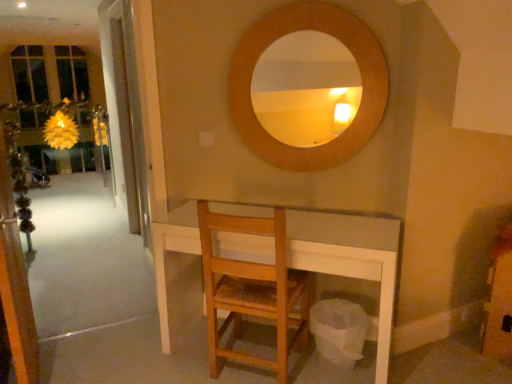
Measure the distance between point (11,227) and camera.

The depth of point (11,227) is 6.30 feet.

Describe the element at coordinates (331, 35) in the screenshot. Image resolution: width=512 pixels, height=384 pixels. I see `wooden circle at upper center` at that location.

The image size is (512, 384). I want to click on wooden circle at upper center, so click(x=331, y=35).

What do you see at coordinates (129, 115) in the screenshot? I see `clear glass door at left, which is counted as the 2th screen door, starting from the front` at bounding box center [129, 115].

Locate an element on the screen. transparent glass screen door at left, the second screen door from the back is located at coordinates (15, 282).

Could you tell me if transparent glass screen door at left, which is the first screen door from front to back, is turned towards wooden chair at center?

Yes, transparent glass screen door at left, which is the first screen door from front to back, is facing wooden chair at center.

Is transparent glass screen door at left, which is the first screen door from front to back, wider or thinner than wooden chair at center?

Considering their sizes, transparent glass screen door at left, which is the first screen door from front to back, looks slimmer than wooden chair at center.

Does point (0, 152) come farther from viewer compared to point (237, 322)?

That is False.

From the image's perspective, which one is positioned lower, transparent glass screen door at left, which is the first screen door from front to back, or wooden chair at center?

From the image's view, wooden chair at center is below.

Is point (244, 139) closer or farther from the camera than point (125, 80)?

Point (244, 139) is positioned closer to the camera compared to point (125, 80).

Which of these two, wooden circle at upper center or clear glass door at left, the first screen door in the back-to-front sequence, is wider?

clear glass door at left, the first screen door in the back-to-front sequence.

Is wooden circle at upper center positioned with its back to clear glass door at left, the first screen door in the back-to-front sequence?

No, clear glass door at left, the first screen door in the back-to-front sequence, is not at the back of wooden circle at upper center.

This screenshot has width=512, height=384. Identify the location of mirror in front of the clear glass door at left, which is counted as the 2th screen door, starting from the front. (331, 35).

From the image's perspective, who appears lower, transparent glass screen door at left, the second screen door from the back, or clear glass door at left, which is counted as the 2th screen door, starting from the front?

transparent glass screen door at left, the second screen door from the back, appears lower in the image.

From a real-world perspective, is transparent glass screen door at left, which is the first screen door from front to back, below clear glass door at left, which is counted as the 2th screen door, starting from the front?

Yes, from a real-world perspective, transparent glass screen door at left, which is the first screen door from front to back, is beneath clear glass door at left, which is counted as the 2th screen door, starting from the front.

Can you confirm if transparent glass screen door at left, which is the first screen door from front to back, is shorter than clear glass door at left, the first screen door in the back-to-front sequence?

Indeed, transparent glass screen door at left, which is the first screen door from front to back, has a lesser height compared to clear glass door at left, the first screen door in the back-to-front sequence.

Is transparent glass screen door at left, the second screen door from the back, placed right next to clear glass door at left, which is counted as the 2th screen door, starting from the front?

transparent glass screen door at left, the second screen door from the back, and clear glass door at left, which is counted as the 2th screen door, starting from the front, are clearly separated.

Can you tell me how much clear glass door at left, the first screen door in the back-to-front sequence, and transparent glass screen door at left, which is the first screen door from front to back, differ in facing direction?

They differ by 179 degrees in their facing directions.

Does clear glass door at left, the first screen door in the back-to-front sequence, have a lesser height compared to transparent glass screen door at left, the second screen door from the back?

No, clear glass door at left, the first screen door in the back-to-front sequence, is not shorter than transparent glass screen door at left, the second screen door from the back.

From the image's perspective, is clear glass door at left, which is counted as the 2th screen door, starting from the front, located above transparent glass screen door at left, the second screen door from the back?

Yes.

Measure the distance between clear glass door at left, which is counted as the 2th screen door, starting from the front, and transparent glass screen door at left, which is the first screen door from front to back.

3.75 feet.

From the image's perspective, would you say wooden chair at center is shown under wooden circle at upper center?

Yes.

Considering the positions of objects wooden chair at center and wooden circle at upper center in the image provided, who is more to the left, wooden chair at center or wooden circle at upper center?

wooden chair at center.

Is point (287, 331) closer to camera compared to point (247, 66)?

Yes, point (287, 331) is in front of point (247, 66).

From a real-world perspective, between wooden chair at center and wooden circle at upper center, who is vertically lower?

From a 3D spatial view, wooden chair at center is below.

Can you confirm if wooden chair at center is bigger than clear glass door at left, which is counted as the 2th screen door, starting from the front?

Yes.

Does wooden chair at center touch clear glass door at left, which is counted as the 2th screen door, starting from the front?

No, wooden chair at center is not beside clear glass door at left, which is counted as the 2th screen door, starting from the front.

How many degrees apart are the facing directions of wooden chair at center and clear glass door at left, the first screen door in the back-to-front sequence?

137 degrees.

From their relative heights in the image, would you say wooden chair at center is taller or shorter than clear glass door at left, the first screen door in the back-to-front sequence?

In the image, wooden chair at center appears to be shorter than clear glass door at left, the first screen door in the back-to-front sequence.

Based on the photo, which of these two, clear glass door at left, the first screen door in the back-to-front sequence, or wooden chair at center, is bigger?

Bigger between the two is wooden chair at center.

Where is `chair on the right of clear glass door at left, which is counted as the 2th screen door, starting from the front`? This screenshot has width=512, height=384. chair on the right of clear glass door at left, which is counted as the 2th screen door, starting from the front is located at coordinates (252, 290).

Does clear glass door at left, the first screen door in the back-to-front sequence, have a greater width compared to wooden chair at center?

No, clear glass door at left, the first screen door in the back-to-front sequence, is not wider than wooden chair at center.

Based on the photo, between clear glass door at left, the first screen door in the back-to-front sequence, and wooden chair at center, which one appears on the left side from the viewer's perspective?

From the viewer's perspective, clear glass door at left, the first screen door in the back-to-front sequence, appears more on the left side.

Image resolution: width=512 pixels, height=384 pixels. I want to click on chair directly beneath the transparent glass screen door at left, which is the first screen door from front to back (from a real-world perspective), so click(252, 290).

Locate an element on the screen. mirror above the clear glass door at left, which is counted as the 2th screen door, starting from the front (from a real-world perspective) is located at coordinates (331, 35).

Looking at the image, which one is located closer to wooden chair at center, wooden circle at upper center or transparent glass screen door at left, which is the first screen door from front to back?

wooden circle at upper center.

Looking at the image, which one is located closer to wooden chair at center, clear glass door at left, the first screen door in the back-to-front sequence, or transparent glass screen door at left, the second screen door from the back?

Based on the image, transparent glass screen door at left, the second screen door from the back, appears to be nearer to wooden chair at center.

Estimate the real-world distances between objects in this image. Which object is further from transparent glass screen door at left, which is the first screen door from front to back, wooden chair at center or clear glass door at left, which is counted as the 2th screen door, starting from the front?

The object further to transparent glass screen door at left, which is the first screen door from front to back, is clear glass door at left, which is counted as the 2th screen door, starting from the front.

When comparing their distances from clear glass door at left, the first screen door in the back-to-front sequence, does transparent glass screen door at left, which is the first screen door from front to back, or wooden chair at center seem further?

Among the two, wooden chair at center is located further to clear glass door at left, the first screen door in the back-to-front sequence.

Considering their positions, is clear glass door at left, which is counted as the 2th screen door, starting from the front, positioned further to wooden circle at upper center than transparent glass screen door at left, the second screen door from the back?

Among the two, transparent glass screen door at left, the second screen door from the back, is located further to wooden circle at upper center.

Which object lies nearer to the anchor point wooden circle at upper center, wooden chair at center or transparent glass screen door at left, the second screen door from the back?

wooden chair at center is positioned closer to the anchor wooden circle at upper center.

When comparing their distances from wooden chair at center, does wooden circle at upper center or clear glass door at left, which is counted as the 2th screen door, starting from the front, seem further?

clear glass door at left, which is counted as the 2th screen door, starting from the front, lies further to wooden chair at center than the other object.

Based on their spatial positions, is wooden chair at center or clear glass door at left, the first screen door in the back-to-front sequence, further from wooden circle at upper center?

Based on the image, clear glass door at left, the first screen door in the back-to-front sequence, appears to be further to wooden circle at upper center.

At what (x,y) coordinates should I click in order to perform the action: click on chair between transparent glass screen door at left, which is the first screen door from front to back, and wooden circle at upper center from left to right. Please return your answer as a coordinate pair (x, y). This screenshot has height=384, width=512. Looking at the image, I should click on (252, 290).

Identify the location of mirror between transparent glass screen door at left, which is the first screen door from front to back, and clear glass door at left, which is counted as the 2th screen door, starting from the front, in the front-back direction. (331, 35).

Where is `chair between clear glass door at left, which is counted as the 2th screen door, starting from the front, and wooden circle at upper center, in the horizontal direction`? This screenshot has height=384, width=512. chair between clear glass door at left, which is counted as the 2th screen door, starting from the front, and wooden circle at upper center, in the horizontal direction is located at coordinates (252, 290).

The image size is (512, 384). I want to click on chair between transparent glass screen door at left, the second screen door from the back, and clear glass door at left, which is counted as the 2th screen door, starting from the front, from front to back, so click(x=252, y=290).